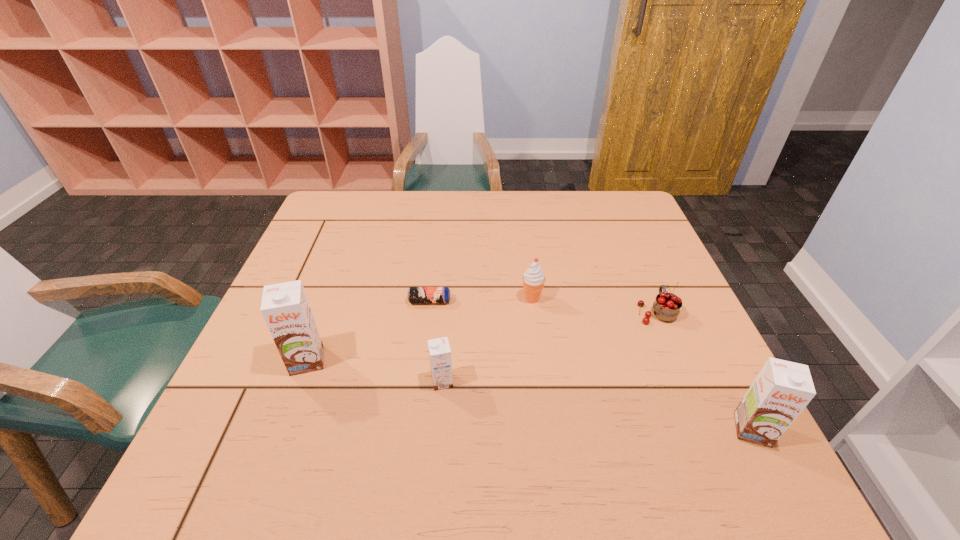
At what (x,y) coordinates should I click in order to perform the action: click on object at the near right corner. Please return your answer as a coordinate pair (x, y). Image resolution: width=960 pixels, height=540 pixels. Looking at the image, I should click on (782, 389).

At what (x,y) coordinates should I click in order to perform the action: click on free spot at the far edge of the desktop. Please return your answer as a coordinate pair (x, y). The image size is (960, 540). Looking at the image, I should click on (498, 206).

In the image, there is a desktop. Identify the location of free space at the left edge. The width and height of the screenshot is (960, 540). (348, 256).

Locate an element on the screen. vacant space at the right edge of the desktop is located at coordinates [x=645, y=336].

Where is `vacant space at the near right corner of the desktop`? vacant space at the near right corner of the desktop is located at coordinates (702, 426).

You are a GUI agent. You are given a task and a screenshot of the screen. Output one action in this format:
    pyautogui.click(x=<x>, y=<y>)
    Task: Click on the free space between the third object from right to left and the leftmost chocolate milk
    This screenshot has width=960, height=540.
    Given the screenshot: What is the action you would take?
    pyautogui.click(x=420, y=329)

The image size is (960, 540). What are the coordinates of `empty space between the rightmost object and the leftmost object` in the screenshot? It's located at coord(530,395).

This screenshot has height=540, width=960. In order to click on free space between the fifth tallest object and the fourth object from left to right in this screenshot , I will do `click(594, 305)`.

The width and height of the screenshot is (960, 540). Find the location of `free spot between the shortest chocolate milk and the nearest object`. free spot between the shortest chocolate milk and the nearest object is located at coordinates (597, 406).

The height and width of the screenshot is (540, 960). Find the location of `vacant region between the second tallest object and the leftmost chocolate milk`. vacant region between the second tallest object and the leftmost chocolate milk is located at coordinates (530, 395).